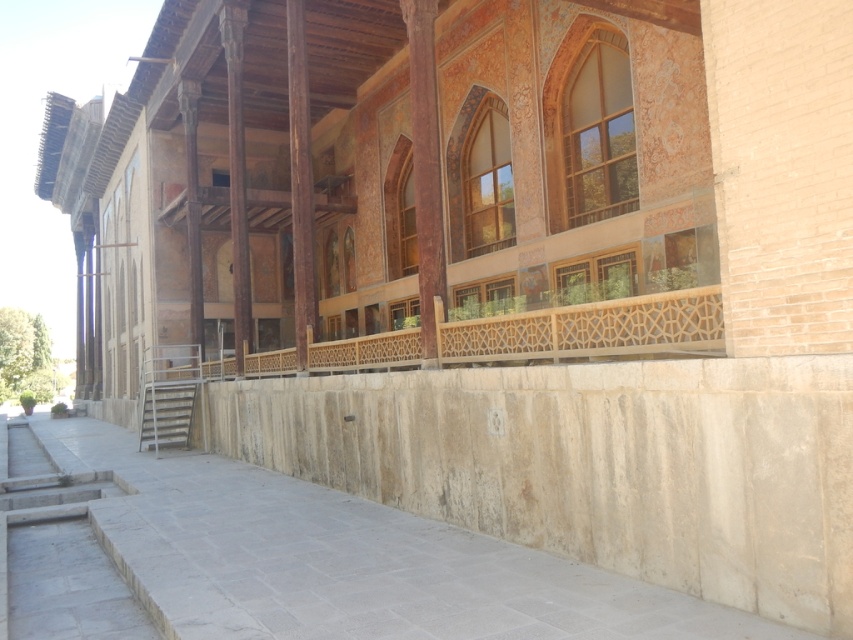
Question: Does wooden lattice balustrade at center appear on the right side of matte brown pillar at center?

Choices:
 (A) yes
 (B) no

Answer: (A)

Question: Can you confirm if wooden lattice balustrade at center is smaller than matte brown pillar at center?

Choices:
 (A) yes
 (B) no

Answer: (B)

Question: Which point appears farthest from the camera in this image?

Choices:
 (A) (419, 204)
 (B) (483, 348)

Answer: (A)

Question: Does wooden lattice balustrade at center appear over matte brown pillar at center?

Choices:
 (A) no
 (B) yes

Answer: (A)